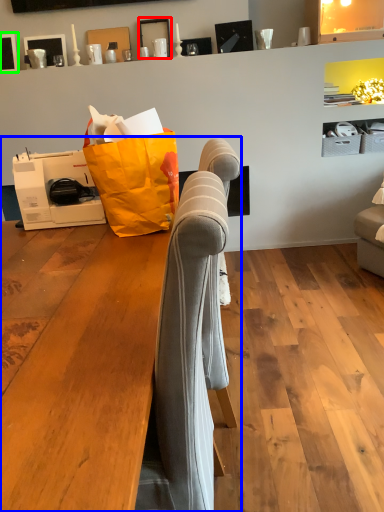
Question: Which is farther away from picture frame (highlighted by a red box)? furniture (highlighted by a blue box) or picture frame (highlighted by a green box)?

Choices:
 (A) furniture
 (B) picture frame

Answer: (A)